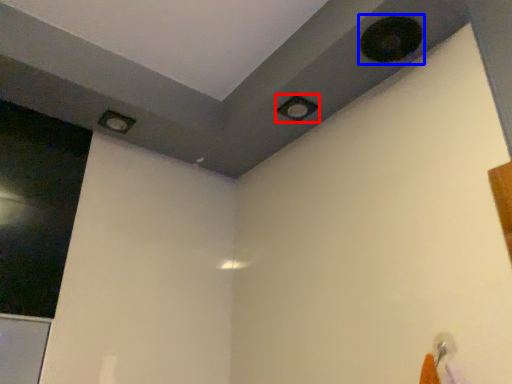
Question: Among these objects, which one is nearest to the camera, hole (highlighted by a red box) or hole (highlighted by a blue box)?

Choices:
 (A) hole
 (B) hole

Answer: (B)